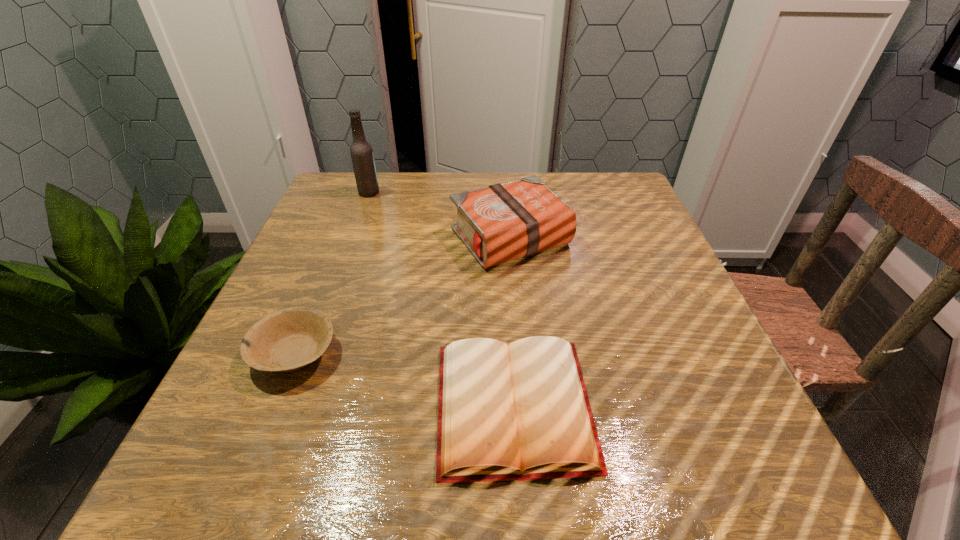
The width and height of the screenshot is (960, 540). In order to click on vacant space at the far left corner of the desktop in this screenshot , I will do `click(314, 215)`.

Image resolution: width=960 pixels, height=540 pixels. In the image, there is a desktop. Find the location of `vacant space at the near left corner`. vacant space at the near left corner is located at coordinates (221, 498).

You are a GUI agent. You are given a task and a screenshot of the screen. Output one action in this format:
    pyautogui.click(x=<x>, y=<y>)
    Task: Click on the vacant area at the near right corner
    
    Given the screenshot: What is the action you would take?
    pyautogui.click(x=745, y=477)

The image size is (960, 540). In order to click on unoccupied position between the second shortest object and the shortest object in this screenshot , I will do `click(404, 380)`.

You are a GUI agent. You are given a task and a screenshot of the screen. Output one action in this format:
    pyautogui.click(x=<x>, y=<y>)
    Task: Click on the blank region between the shorter Bible and the second farthest object
    This screenshot has height=540, width=960.
    Given the screenshot: What is the action you would take?
    pyautogui.click(x=512, y=322)

This screenshot has width=960, height=540. Identify the location of free space between the shortest object and the second shortest object. point(404,380).

I want to click on vacant point located between the third shortest object and the tallest object, so click(x=440, y=215).

This screenshot has width=960, height=540. I want to click on vacant space that's between the bowl and the nearer Bible, so click(404, 380).

The image size is (960, 540). In order to click on vacant space that is in between the taller Bible and the tallest object in this screenshot , I will do `click(440, 215)`.

You are a GUI agent. You are given a task and a screenshot of the screen. Output one action in this format:
    pyautogui.click(x=<x>, y=<y>)
    Task: Click on the vacant region between the bowl and the tallest object
    
    Given the screenshot: What is the action you would take?
    pyautogui.click(x=331, y=273)